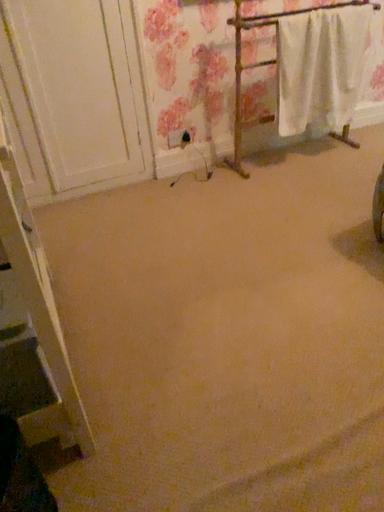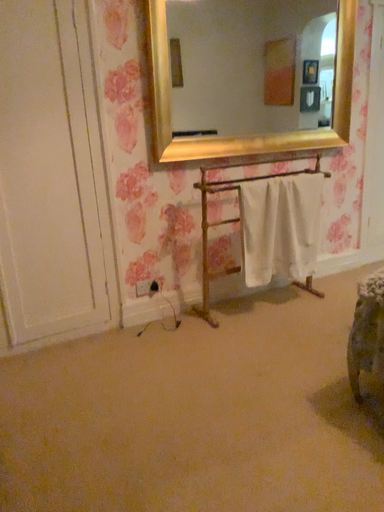
Question: Which way did the camera rotate in the video?

Choices:
 (A) rotated downward
 (B) rotated upward

Answer: (B)